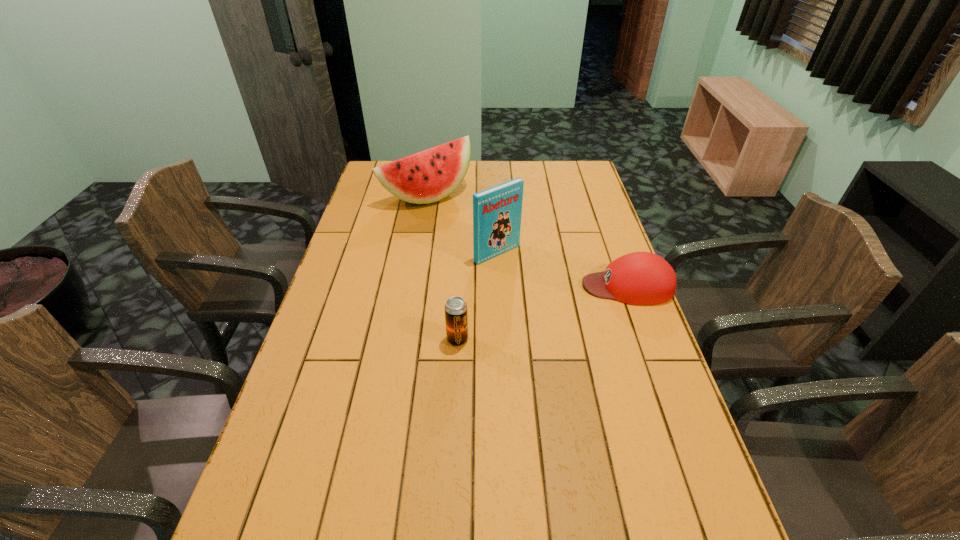
Identify the location of vacant spot on the desktop that is between the nearest object and the baseball cap and is positioned on the outer rind of the watermelon. (558, 308).

Image resolution: width=960 pixels, height=540 pixels. What are the coordinates of `free space on the desktop that is between the second shortest object and the baseball cap and is positioned on the front cover of the second farthest object` in the screenshot? It's located at (560, 307).